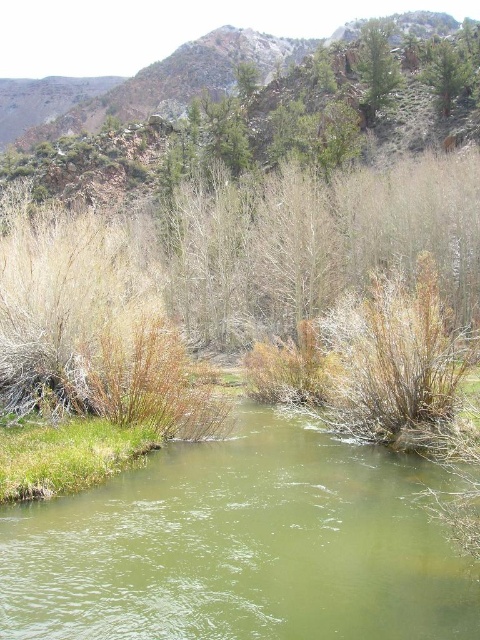
Can you confirm if green grassy stream at center is positioned to the right of green grassy bank at lower left?

Correct, you'll find green grassy stream at center to the right of green grassy bank at lower left.

Is point (157, 513) farther from camera compared to point (32, 445)?

No.

Does point (381, 564) come in front of point (90, 454)?

Yes, it is in front of point (90, 454).

Locate an element on the screen. This screenshot has height=640, width=480. green grassy stream at center is located at coordinates (242, 547).

Is green grassy bank at lower left wider than green leafy tree at upper right?

Correct, the width of green grassy bank at lower left exceeds that of green leafy tree at upper right.

Can you confirm if green grassy bank at lower left is smaller than green leafy tree at upper right?

Yes.

What do you see at coordinates (64, 456) in the screenshot? I see `green grassy bank at lower left` at bounding box center [64, 456].

The image size is (480, 640). What are the coordinates of `green grassy bank at lower left` in the screenshot? It's located at (64, 456).

Which is behind, point (437, 586) or point (459, 64)?

The point (459, 64) is behind.

Does green grassy stream at center have a smaller size compared to green leafy tree at upper right?

Yes.

Who is more distant from viewer, (x=419, y=544) or (x=437, y=74)?

The point (x=437, y=74) is behind.

Where is `green grassy stream at center`? green grassy stream at center is located at coordinates (242, 547).